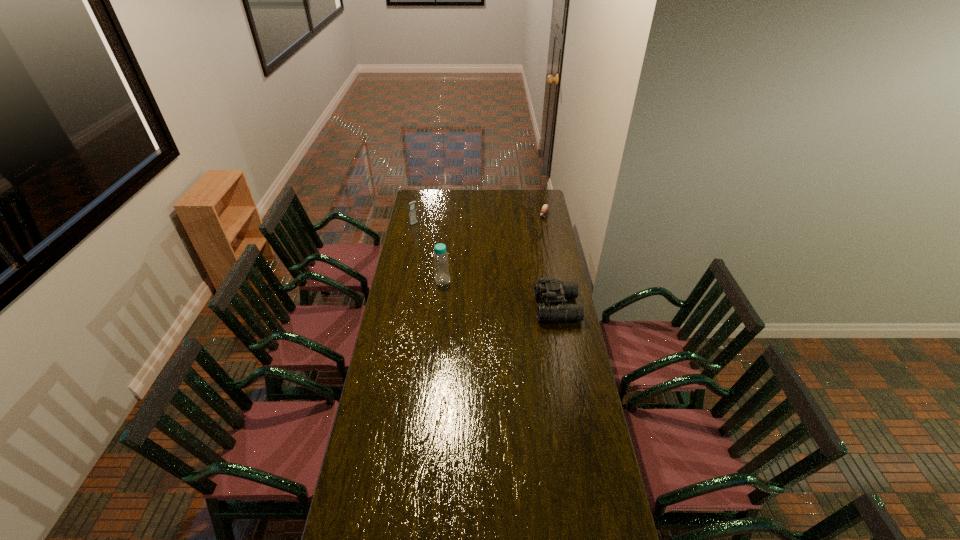
This screenshot has height=540, width=960. I want to click on free space on the desktop that is between the tallest object and the binoculars and is positioned on the front-facing side of the second farthest object, so click(x=506, y=295).

Image resolution: width=960 pixels, height=540 pixels. I want to click on free space on the desktop that is between the second object from left to right and the nearest object and is positioned on the front-facing side of the shortest object, so click(x=488, y=291).